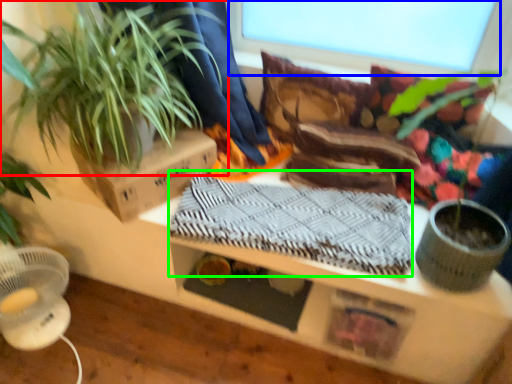
Question: Based on their relative distances, which object is farther from houseplant (highlighted by a red box)? Choose from window screen (highlighted by a blue box) and blanket (highlighted by a green box).

Choices:
 (A) window screen
 (B) blanket

Answer: (A)